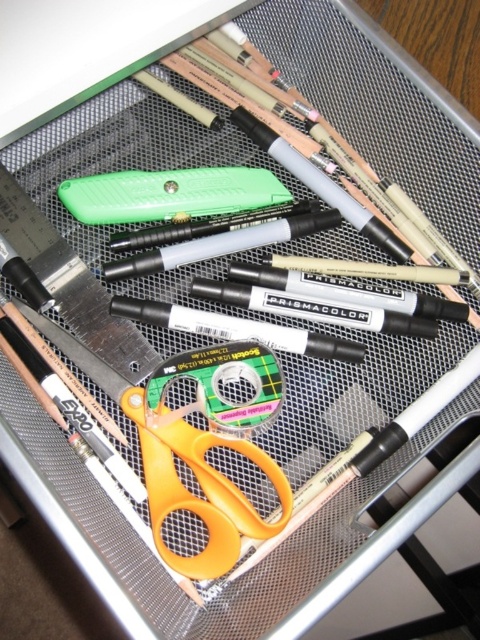
In the scene shown: You are organizing an art supply drawer and need to locate the orange plastic scissors at center. According to the drawer layout, where exactly are they positioned?

The orange plastic scissors at center are positioned at point 0.766 on the x axis and 0.421 on the y axis.

You have a small storage box that can only fit items narrower than the green plastic utility knife at center. Can the orange plastic scissors at center fit into the box?

The orange plastic scissors at center has a width less than the green plastic utility knife at center, so yes, the orange plastic scissors at center can fit into the box since it is narrower than the green plastic utility knife at center.